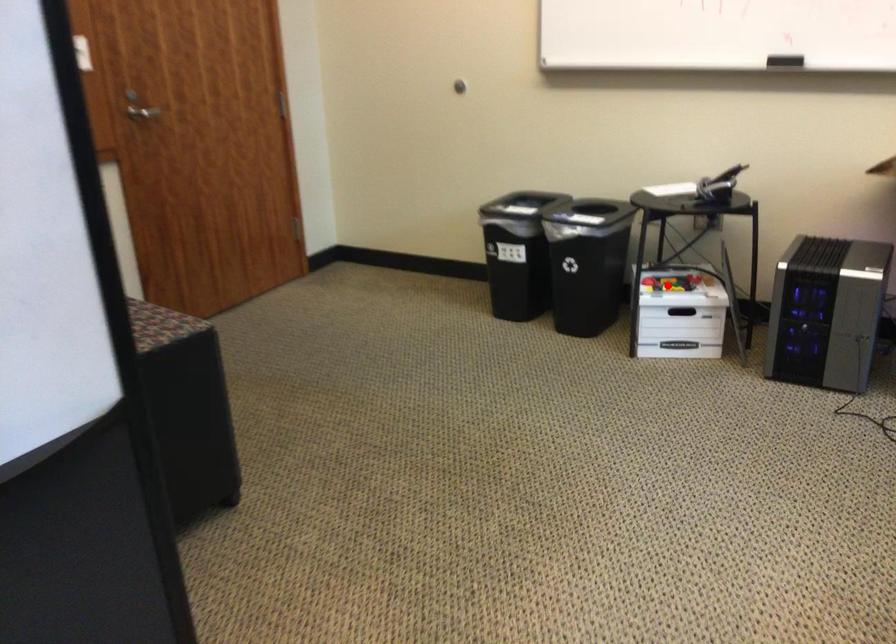
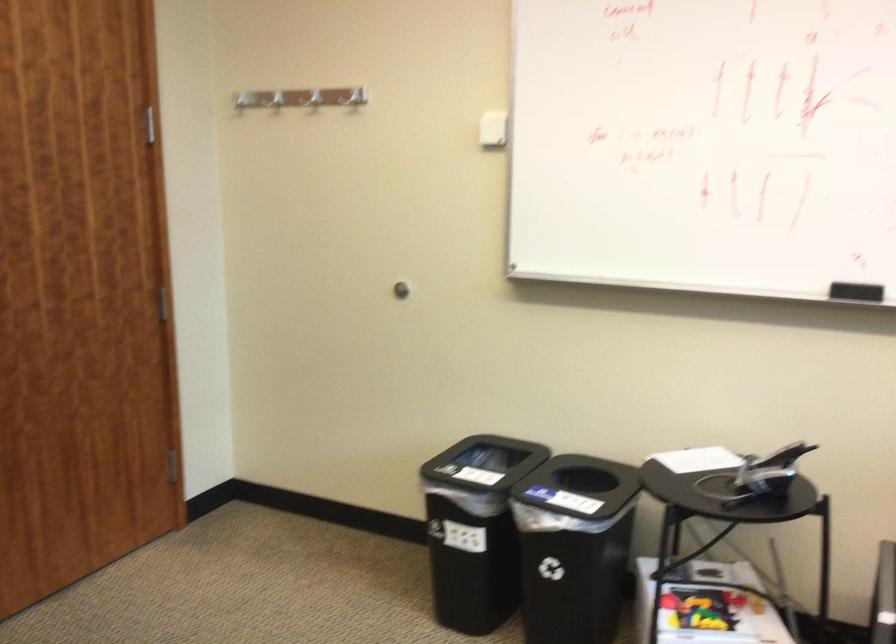
Locate, in the second image, the point that corresponds to the highlighted location in the first image.

(701, 609)